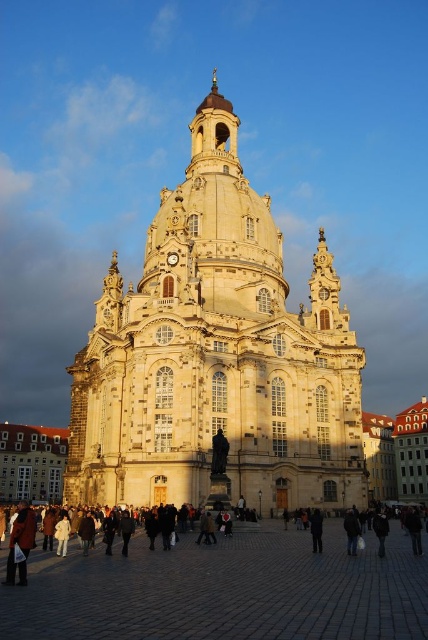
The width and height of the screenshot is (428, 640). Find the location of `dark brown leather jacket at lower right`. dark brown leather jacket at lower right is located at coordinates (351, 531).

Measure the distance between dark brown leather jacket at lower right and camera.

dark brown leather jacket at lower right is 144.52 feet from camera.

Locate an element on the screen. The width and height of the screenshot is (428, 640). dark brown leather jacket at lower right is located at coordinates (351, 531).

Is brown cobblestone at center shorter than dark brown leather jacket at lower right?

No, brown cobblestone at center is not shorter than dark brown leather jacket at lower right.

At what (x,y) coordinates should I click in order to perform the action: click on brown cobblestone at center. Please return your answer as a coordinate pair (x, y). Looking at the image, I should click on (225, 589).

Who is higher up, stone textured church at center or dark gray fabric at center?

stone textured church at center is above.

Between point (107, 464) and point (314, 552), which one is positioned in front?

Point (314, 552) is more forward.

Locate an element on the screen. The height and width of the screenshot is (640, 428). stone textured church at center is located at coordinates (216, 356).